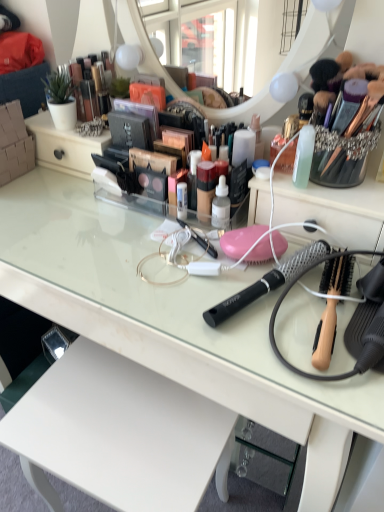
You are a GUI agent. You are given a task and a screenshot of the screen. Output one action in this format:
    pyautogui.click(x=<x>, y=<y>)
    Task: Click on the vacant area on top of clear glass desk at center (from a real-world perspective)
    The image size is (384, 512).
    Given the screenshot: What is the action you would take?
    pyautogui.click(x=142, y=242)